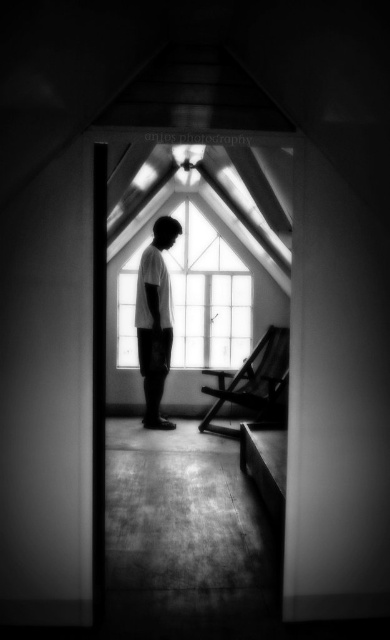
You are an interior designer planning to install a new decorative element between the transparent glass window at center and the white matte shirt at center. Based on their relative sizes, which object should the decorative element be placed closer to?

The decorative element should be placed closer to the white matte shirt at center because the transparent glass window at center is wider than the white matte shirt at center, so the shirt is narrower and requires less space.

You are standing in the church and want to see the view outside through the transparent glass window at center. Since the white matte shirt at center is blocking your view, can you move around to see the outside view without moving the person?

The transparent glass window at center is above the white matte shirt at center, so you can move your head upward to look over the white matte shirt at center and see through the transparent glass window at center.

You are standing in the church and want to walk from point A to point B. Point A is at coordinates point (228, 316) and point B is at coordinates point (145, 342). According to the image, which direction should you face to move from point A to point B?

To move from point A to point B, you should face downward because point A is behind point B, meaning point B is in front of point A.